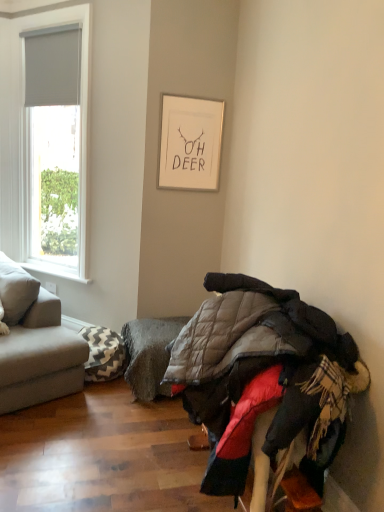
Question: Is gray textured footrest at lower center in front of or behind gray fabric blind at upper left in the image?

Choices:
 (A) front
 (B) behind

Answer: (A)

Question: Considering the positions of gray textured footrest at lower center and gray fabric blind at upper left in the image, is gray textured footrest at lower center taller or shorter than gray fabric blind at upper left?

Choices:
 (A) short
 (B) tall

Answer: (A)

Question: Which object is positioned closest to the gray fabric blind at upper left?

Choices:
 (A) white matte picture frame at upper center
 (B) white matte window at left
 (C) white painted wood at left
 (D) gray fabric couch at left
 (E) chevron-patterned fabric pillow at lower left

Answer: (B)

Question: Which object is positioned closest to the gray fabric blind at upper left?

Choices:
 (A) quilted fabric jackets at lower right
 (B) gray fabric couch at left
 (C) white painted wood at left
 (D) chevron-patterned fabric pillow at lower left
 (E) white matte picture frame at upper center

Answer: (E)